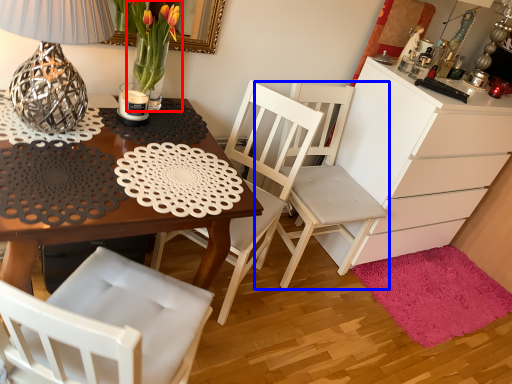
Question: Which point is closer to the camera, floral arrangement (highlighted by a red box) or chair (highlighted by a blue box)?

Choices:
 (A) floral arrangement
 (B) chair

Answer: (A)